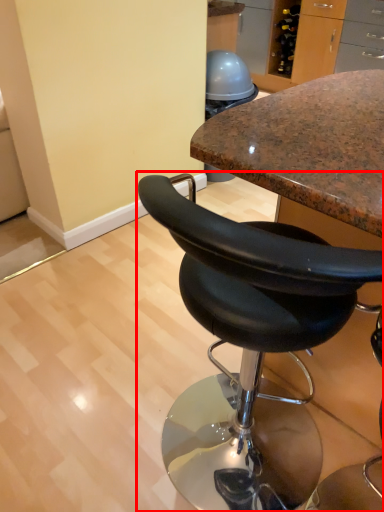
Question: From the image's perspective, where is chair (annotated by the red box) located relative to chair?

Choices:
 (A) below
 (B) above

Answer: (B)